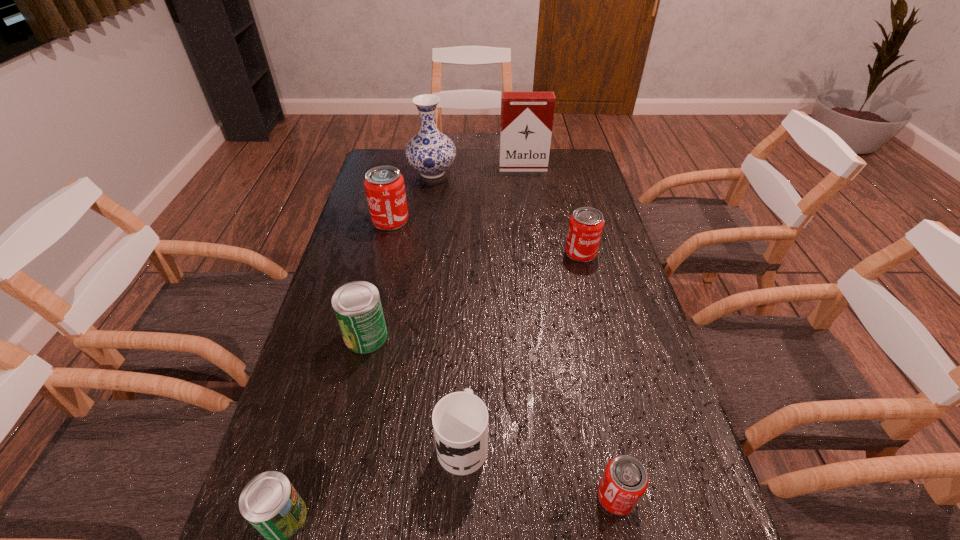
Locate an element on the screen. This screenshot has height=540, width=960. free space that is in between the smallest red can and the farther green can is located at coordinates (491, 416).

This screenshot has height=540, width=960. I want to click on free space between the smallest red can and the farthest can, so click(503, 359).

Identify the location of vacant region between the cigarette_case and the smallest red can. The image size is (960, 540). (569, 332).

Where is `free space between the mug and the fourth nearest object`? free space between the mug and the fourth nearest object is located at coordinates [414, 388].

This screenshot has width=960, height=540. What are the coordinates of `vacant region between the tallest can and the white mug` in the screenshot? It's located at (426, 330).

Where is `vacant area that lies between the blue vase and the cigarette_case`? The width and height of the screenshot is (960, 540). vacant area that lies between the blue vase and the cigarette_case is located at coordinates (478, 170).

Choose which object is the second nearest neighbor to the mug. Please provide its 2D coordinates. Your answer should be formatted as a tuple, i.e. [(x, y)], where the tuple contains the x and y coordinates of a point satisfying the conditions above.

[(357, 305)]

Select which object is the fourth closest to the fourth nearest object. Please provide its 2D coordinates. Your answer should be formatted as a tuple, i.e. [(x, y)], where the tuple contains the x and y coordinates of a point satisfying the conditions above.

[(586, 224)]

This screenshot has width=960, height=540. I want to click on can that stands as the closest to the second farthest red can, so click(x=384, y=185).

Locate which can ranks in proximity to the bigger green can. Please provide its 2D coordinates. Your answer should be formatted as a tuple, i.e. [(x, y)], where the tuple contains the x and y coordinates of a point satisfying the conditions above.

[(269, 502)]